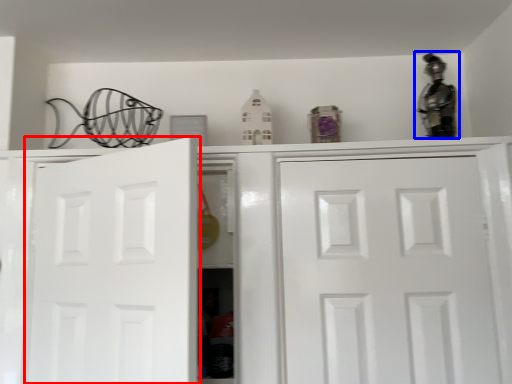
Question: Which of the following is the farthest to the observer, door (highlighted by a red box) or figurine (highlighted by a blue box)?

Choices:
 (A) door
 (B) figurine

Answer: (B)